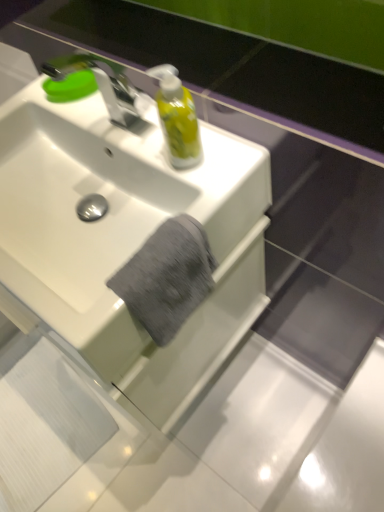
Question: From the image's perspective, is white glossy sink at center above translucent yellow liquid at upper center?

Choices:
 (A) no
 (B) yes

Answer: (A)

Question: From a real-world perspective, is white glossy sink at center over translucent yellow liquid at upper center?

Choices:
 (A) no
 (B) yes

Answer: (A)

Question: Would you say translucent yellow liquid at upper center is part of white glossy sink at center's contents?

Choices:
 (A) yes
 (B) no

Answer: (B)

Question: Does white glossy sink at center turn towards translucent yellow liquid at upper center?

Choices:
 (A) yes
 (B) no

Answer: (B)

Question: Is white glossy sink at center behind translucent yellow liquid at upper center?

Choices:
 (A) no
 (B) yes

Answer: (A)

Question: Considering the positions of point (175, 271) and point (102, 74), is point (175, 271) closer or farther from the camera than point (102, 74)?

Choices:
 (A) closer
 (B) farther

Answer: (A)

Question: Is gray cotton towel at center situated inside silver metallic faucet at upper left or outside?

Choices:
 (A) outside
 (B) inside

Answer: (A)

Question: From a real-world perspective, is gray cotton towel at center positioned above or below silver metallic faucet at upper left?

Choices:
 (A) above
 (B) below

Answer: (B)

Question: Is gray cotton towel at center taller or shorter than silver metallic faucet at upper left?

Choices:
 (A) short
 (B) tall

Answer: (A)

Question: From the image's perspective, relative to translucent yellow liquid at upper center, is white glossy sink at center above or below?

Choices:
 (A) above
 (B) below

Answer: (B)

Question: Looking at their shapes, would you say white glossy sink at center is wider or thinner than translucent yellow liquid at upper center?

Choices:
 (A) wide
 (B) thin

Answer: (A)

Question: Is white glossy sink at center in front of or behind translucent yellow liquid at upper center in the image?

Choices:
 (A) front
 (B) behind

Answer: (A)

Question: Does point (33, 140) appear closer or farther from the camera than point (187, 95)?

Choices:
 (A) closer
 (B) farther

Answer: (B)

Question: Does point (23, 88) appear closer or farther from the camera than point (168, 327)?

Choices:
 (A) closer
 (B) farther

Answer: (B)

Question: Considering the relative positions of white glossy sink at center and gray cotton towel at center in the image provided, is white glossy sink at center to the left or to the right of gray cotton towel at center?

Choices:
 (A) right
 (B) left

Answer: (B)